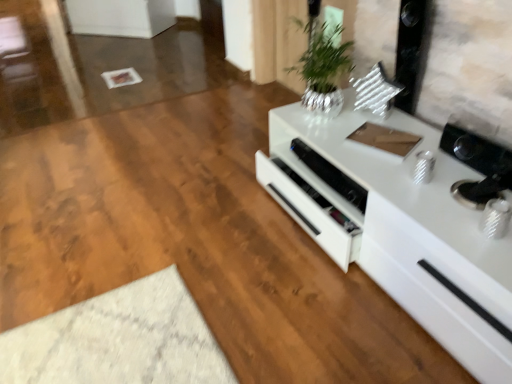
You are a GUI agent. You are given a task and a screenshot of the screen. Output one action in this format:
    pyautogui.click(x=<x>, y=<y>)
    Task: Click on the vacant space in front of silver metallic vase at upper center
    Image resolution: width=512 pixels, height=384 pixels.
    Given the screenshot: What is the action you would take?
    pyautogui.click(x=340, y=140)